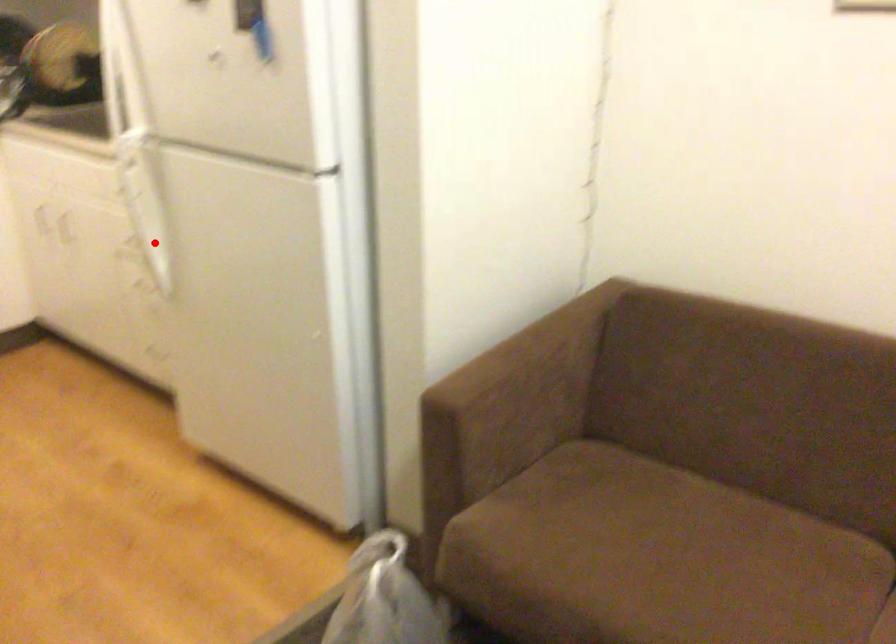
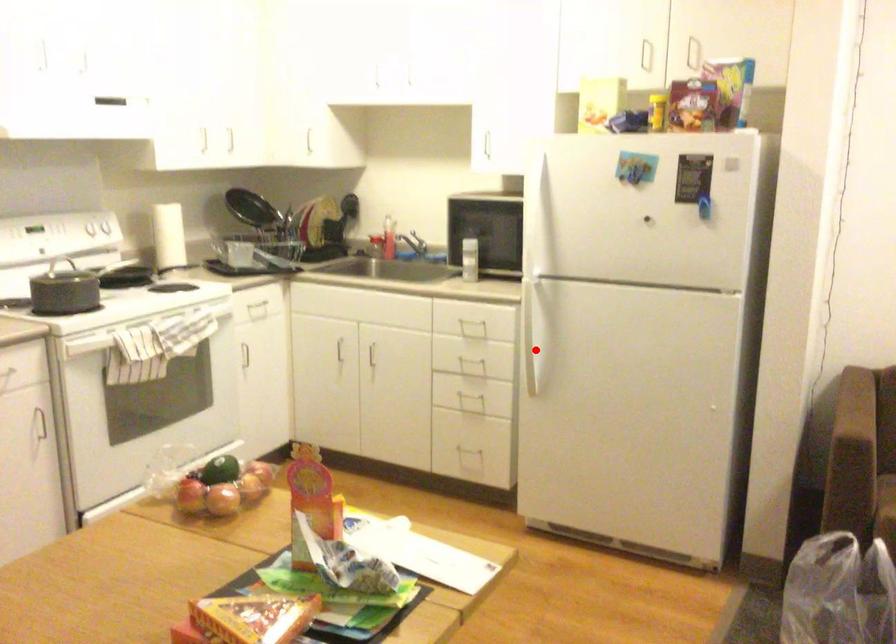
I am providing you with two images of the same scene from different viewpoints. A red point is marked on the first image and another point is marked on the second image. Are the points marked in image1 and image2 representing the same 3D position?

Yes